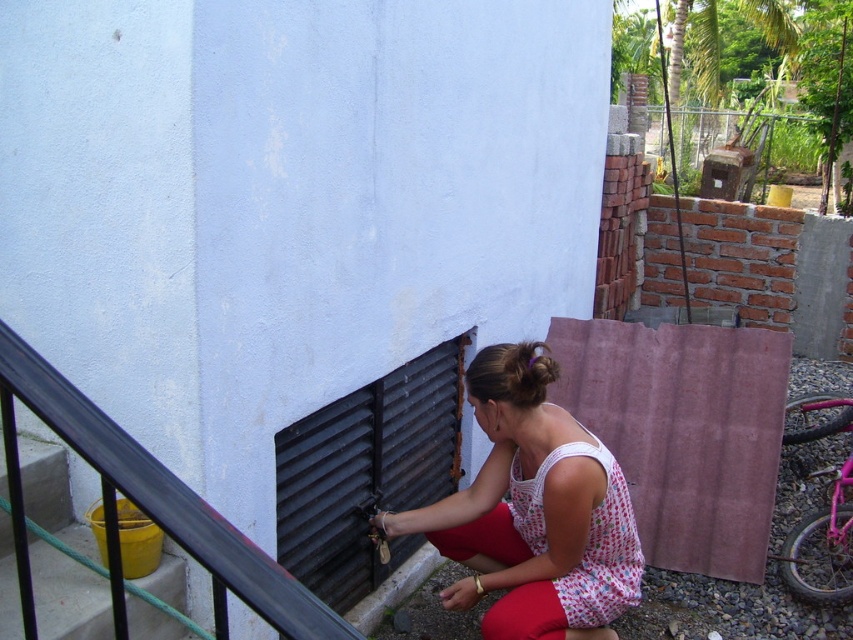
Question: Can you confirm if white dotted dress at center is thinner than metallic gray stair at lower left?

Choices:
 (A) no
 (B) yes

Answer: (A)

Question: Among these points, which one is nearest to the camera?

Choices:
 (A) (10, 584)
 (B) (637, 545)
 (C) (171, 500)

Answer: (C)

Question: Estimate the real-world distances between objects in this image. Which object is farther from the white dotted dress at center?

Choices:
 (A) white dotted fabric dress at lower center
 (B) black metal/rail at lower left
 (C) metallic gray stair at lower left

Answer: (B)

Question: Does white dotted dress at center have a smaller size compared to metallic gray stair at lower left?

Choices:
 (A) no
 (B) yes

Answer: (A)

Question: Does white dotted dress at center appear under white dotted fabric dress at lower center?

Choices:
 (A) yes
 (B) no

Answer: (B)

Question: Which point appears farthest from the camera in this image?

Choices:
 (A) (70, 625)
 (B) (569, 576)
 (C) (486, 461)

Answer: (C)